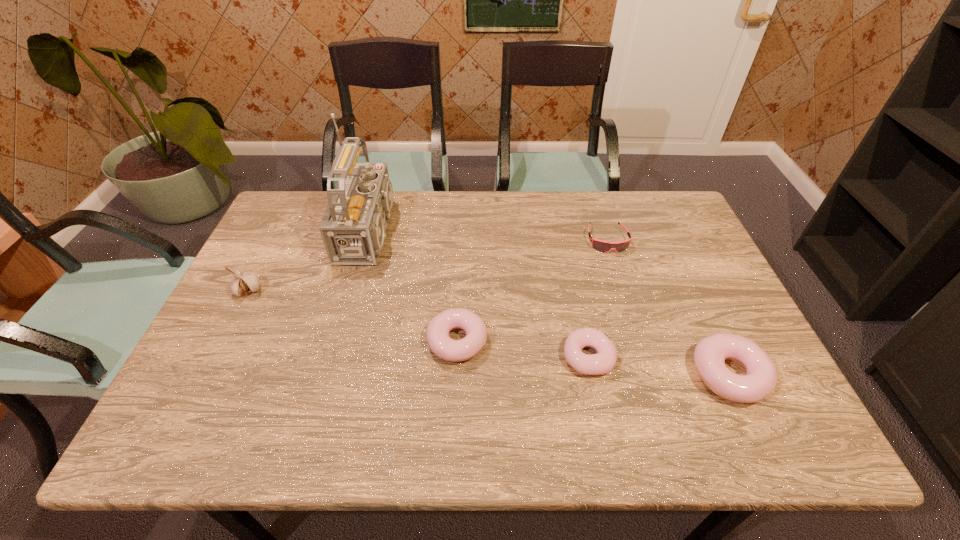
Where is `blank area located 0.290m on the left of the leftmost doughnut`? This screenshot has width=960, height=540. blank area located 0.290m on the left of the leftmost doughnut is located at coordinates (x=308, y=341).

In order to click on vacant point located 0.050m on the front of the fourth object from left to right in this screenshot , I will do `click(597, 400)`.

I want to click on free region located on the back of the rightmost object, so click(x=691, y=292).

Locate an element on the screen. The height and width of the screenshot is (540, 960). vacant space located on the front-facing side of the tallest object is located at coordinates (478, 231).

Where is `vacant space located on the front-facing side of the fifth object from left to right`? vacant space located on the front-facing side of the fifth object from left to right is located at coordinates (627, 303).

Image resolution: width=960 pixels, height=540 pixels. Identify the location of free space located on the right of the garlic. (352, 291).

The image size is (960, 540). Identify the location of radio receiver that is at the far edge. (353, 227).

At what (x,y) coordinates should I click in order to perform the action: click on goggles situated at the far edge. Please return your answer as a coordinate pair (x, y). The width and height of the screenshot is (960, 540). Looking at the image, I should click on (603, 246).

Where is `object that is at the left edge`? This screenshot has width=960, height=540. object that is at the left edge is located at coordinates (246, 282).

Locate an element on the screen. This screenshot has height=540, width=960. object at the right edge is located at coordinates (760, 379).